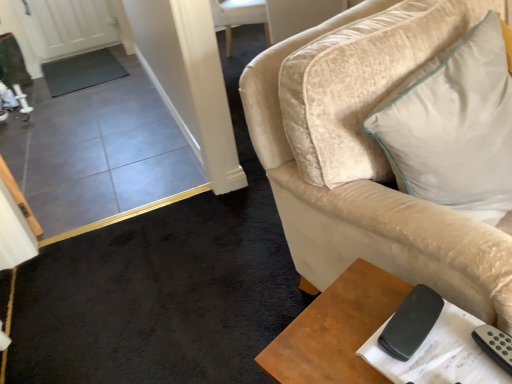
What are the coordinates of `vacant space situated on the left part of black matte remote at lower right` in the screenshot? It's located at (332, 335).